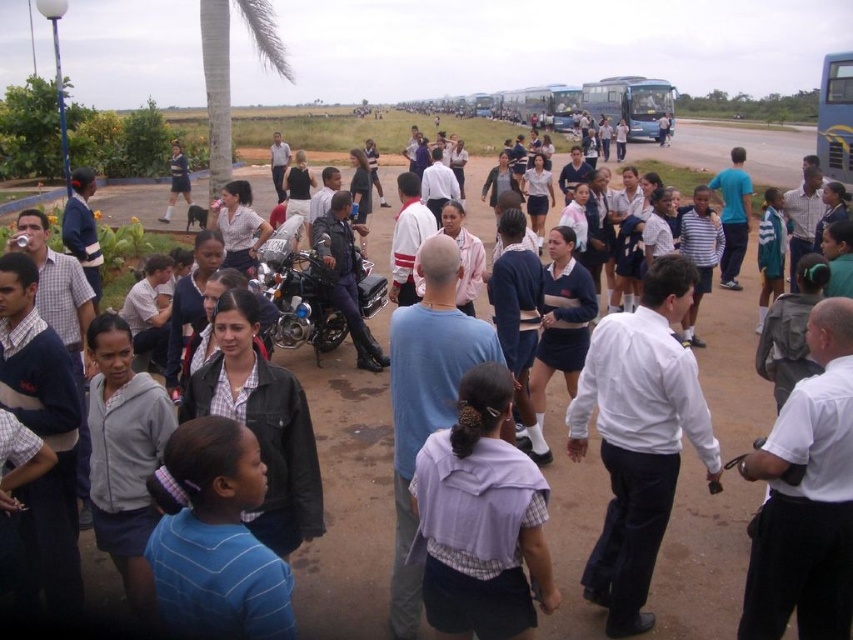
You are a photographer trying to capture a photo of the purple fabric shirt at center and the blue metallic bus at upper center. Based on their positions, which object should you focus on first to ensure both are in the frame?

The purple fabric shirt at center is located below the blue metallic bus at upper center, so you should focus on the blue metallic bus at upper center first to ensure both are in the frame.

You are standing in the scene and want to take a photo of both the point at coordinates (494, 444) and the point at coordinates (599, 108). Which point should you focus on first to ensure both are in focus?

You should focus on the point at coordinates (494, 444) first because it is closer to the camera than the point at coordinates (599, 108). This way, the closer point will be in focus, and the farther point may also be within the depth of field.